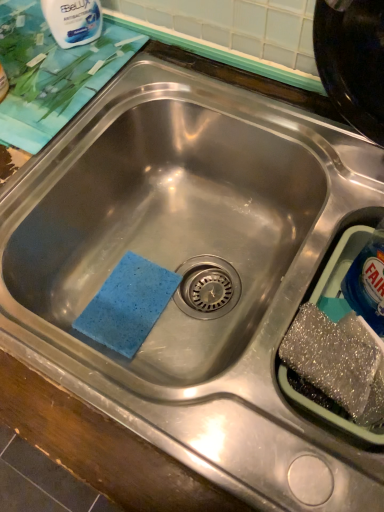
Question: From the image's perspective, is white glossy bottle at upper left over blue plastic bottle at right?

Choices:
 (A) no
 (B) yes

Answer: (B)

Question: Is white glossy bottle at upper left not within blue plastic bottle at right?

Choices:
 (A) no
 (B) yes

Answer: (B)

Question: Could blue plastic bottle at right be considered to be inside white glossy bottle at upper left?

Choices:
 (A) yes
 (B) no

Answer: (B)

Question: Considering the relative sizes of white glossy bottle at upper left and blue plastic bottle at right in the image provided, is white glossy bottle at upper left wider than blue plastic bottle at right?

Choices:
 (A) no
 (B) yes

Answer: (B)

Question: From the image's perspective, is white glossy bottle at upper left beneath blue plastic bottle at right?

Choices:
 (A) no
 (B) yes

Answer: (A)

Question: Does white glossy bottle at upper left have a lesser width compared to blue plastic bottle at right?

Choices:
 (A) yes
 (B) no

Answer: (B)

Question: Is blue plastic bottle at right next to white glossy bottle at upper left and touching it?

Choices:
 (A) yes
 (B) no

Answer: (B)

Question: Is blue plastic bottle at right not within white glossy bottle at upper left?

Choices:
 (A) no
 (B) yes

Answer: (B)

Question: Considering the relative sizes of blue plastic bottle at right and white glossy bottle at upper left in the image provided, is blue plastic bottle at right smaller than white glossy bottle at upper left?

Choices:
 (A) no
 (B) yes

Answer: (A)

Question: Is blue plastic bottle at right positioned with its back to white glossy bottle at upper left?

Choices:
 (A) yes
 (B) no

Answer: (B)

Question: Considering the relative sizes of blue plastic bottle at right and white glossy bottle at upper left in the image provided, is blue plastic bottle at right shorter than white glossy bottle at upper left?

Choices:
 (A) no
 (B) yes

Answer: (A)

Question: Is blue plastic bottle at right oriented towards white glossy bottle at upper left?

Choices:
 (A) yes
 (B) no

Answer: (B)

Question: From a real-world perspective, is blue plastic bottle at right physically located above or below white glossy bottle at upper left?

Choices:
 (A) below
 (B) above

Answer: (A)